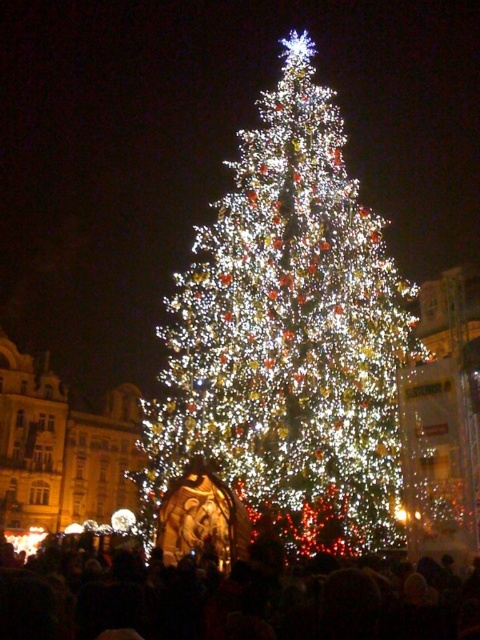
Question: Which point appears farthest from the camera in this image?

Choices:
 (A) (205, 349)
 (B) (312, 611)

Answer: (A)

Question: Which of the following is the closest to the observer?

Choices:
 (A) (445, 604)
 (B) (282, 262)

Answer: (A)

Question: Does illuminated white christmas tree at center have a greater width compared to black matte crowd at lower center?

Choices:
 (A) yes
 (B) no

Answer: (A)

Question: Is the position of illuminated white christmas tree at center less distant than that of black matte crowd at lower center?

Choices:
 (A) yes
 (B) no

Answer: (B)

Question: Does illuminated white christmas tree at center come behind black matte crowd at lower center?

Choices:
 (A) no
 (B) yes

Answer: (B)